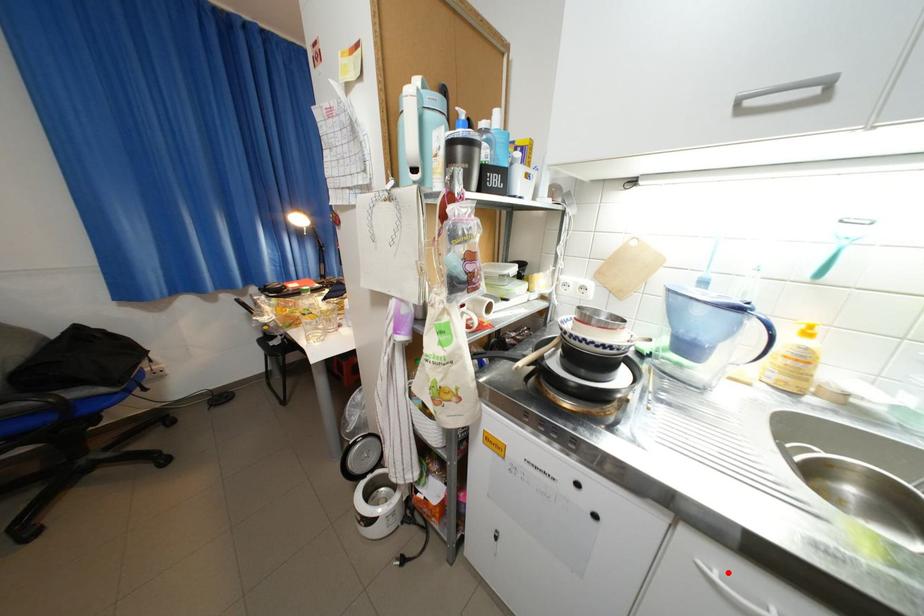
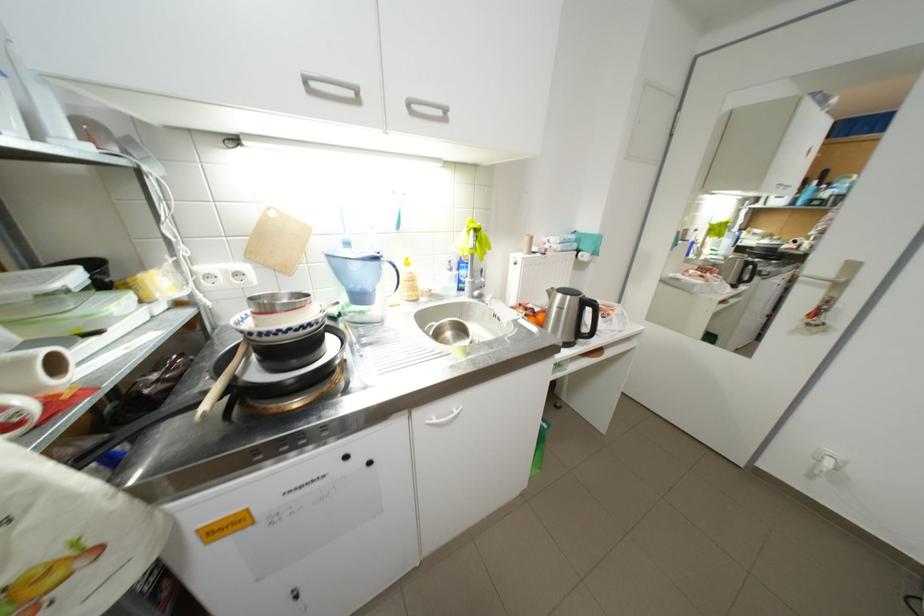
In the second image, find the point that corresponds to the highlighted location in the first image.

(445, 419)